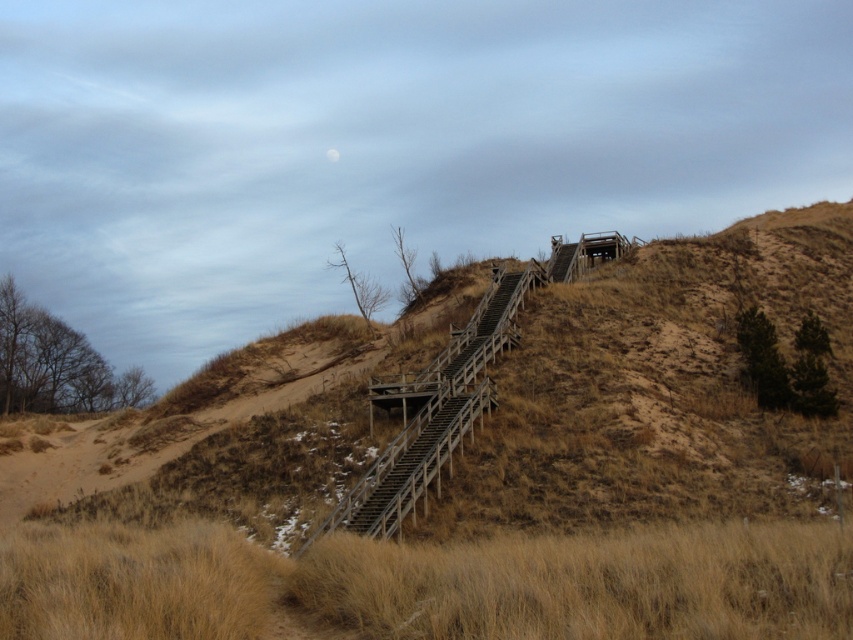
Identify the location of brown wooden stairs at center. The height and width of the screenshot is (640, 853). (663, 388).

The width and height of the screenshot is (853, 640). What do you see at coordinates (663, 388) in the screenshot?
I see `brown wooden stairs at center` at bounding box center [663, 388].

Describe the element at coordinates (663, 388) in the screenshot. I see `brown wooden stairs at center` at that location.

Identify the location of brown wooden stairs at center. This screenshot has width=853, height=640. (663, 388).